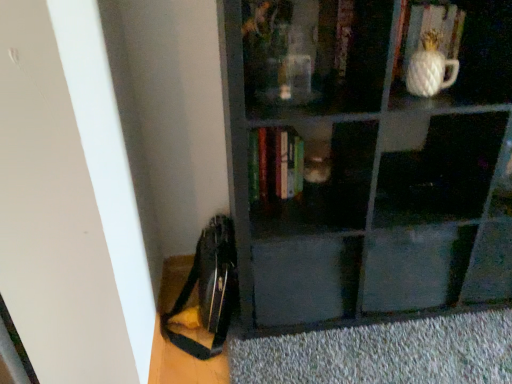
What is the approximate width of white textured vase at upper right?

It is 3.14 inches.

The height and width of the screenshot is (384, 512). Describe the element at coordinates (305, 280) in the screenshot. I see `matte black drawer at center` at that location.

In order to face wooden book at upper center, the second book positioned from the left, should I rotate leftwards or rightwards?

You should look right and rotate roughly 10.298 degrees.

Where is `gray textured doormat at lower right`? gray textured doormat at lower right is located at coordinates (383, 353).

Which is closer, (x=501, y=360) or (x=265, y=317)?

The point (x=501, y=360) is in front.

From a real-world perspective, is gray textured doormat at lower right on top of matte black drawer at center?

No, from a real-world perspective, gray textured doormat at lower right is not over matte black drawer at center

Would you say gray textured doormat at lower right is to the left or to the right of matte black drawer at center in the picture?

gray textured doormat at lower right is positioned on matte black drawer at center's right side.

Would you say gray textured doormat at lower right is outside matte black drawer at center?

gray textured doormat at lower right lies outside matte black drawer at center's area.

Considering the positions of objects white ceramic pineapple at upper right, positioned as the third book in left-to-right order, and gray textured doormat at lower right in the image provided, who is more to the left, white ceramic pineapple at upper right, positioned as the third book in left-to-right order, or gray textured doormat at lower right?

Positioned to the left is gray textured doormat at lower right.

Is white ceramic pineapple at upper right, marked as the 1th book in a right-to-left arrangement, in front of or behind gray textured doormat at lower right in the image?

Visually, white ceramic pineapple at upper right, marked as the 1th book in a right-to-left arrangement, is located behind gray textured doormat at lower right.

Considering the relative sizes of white ceramic pineapple at upper right, positioned as the third book in left-to-right order, and gray textured doormat at lower right in the image provided, is white ceramic pineapple at upper right, positioned as the third book in left-to-right order, taller than gray textured doormat at lower right?

Yes.

Does white ceramic pineapple at upper right, marked as the 1th book in a right-to-left arrangement, turn towards gray textured doormat at lower right?

No, white ceramic pineapple at upper right, marked as the 1th book in a right-to-left arrangement, is not aimed at gray textured doormat at lower right.

Is hardcover books at center, the 3th book when ordered from right to left, directly adjacent to white textured vase at upper right?

They are not placed beside each other.

From a real-world perspective, is hardcover books at center, the 3th book when ordered from right to left, located higher than white textured vase at upper right?

No, from a real-world perspective, hardcover books at center, the 3th book when ordered from right to left, is not over white textured vase at upper right

Which point is more distant from viewer, (291, 149) or (442, 36)?

Positioned behind is point (291, 149).

Is hardcover books at center, the 3th book when ordered from right to left, aimed at white textured vase at upper right?

No, hardcover books at center, the 3th book when ordered from right to left, does not turn towards white textured vase at upper right.

From a real-world perspective, is wooden book at upper center, which is the 2th book from right to left, located beneath gray textured doormat at lower right?

Actually, wooden book at upper center, which is the 2th book from right to left, is physically above gray textured doormat at lower right in the real world.

Is wooden book at upper center, which is the 2th book from right to left, positioned with its back to gray textured doormat at lower right?

No.

Is wooden book at upper center, the second book positioned from the left, surrounding gray textured doormat at lower right?

Actually, gray textured doormat at lower right is outside wooden book at upper center, the second book positioned from the left.

Which of these two, wooden book at upper center, which is the 2th book from right to left, or gray textured doormat at lower right, is wider?

gray textured doormat at lower right.

Looking at this image, is hardcover books at center, the first book viewed from the left, facing away from gray textured doormat at lower right?

No.

Is hardcover books at center, the first book viewed from the left, to the right of gray textured doormat at lower right from the viewer's perspective?

No.

Considering the sizes of objects hardcover books at center, the first book viewed from the left, and gray textured doormat at lower right in the image provided, who is bigger, hardcover books at center, the first book viewed from the left, or gray textured doormat at lower right?

gray textured doormat at lower right is bigger.

Is gray textured doormat at lower right to the right of white ceramic pineapple at upper right, marked as the 1th book in a right-to-left arrangement, from the viewer's perspective?

In fact, gray textured doormat at lower right is to the left of white ceramic pineapple at upper right, marked as the 1th book in a right-to-left arrangement.

Who is smaller, gray textured doormat at lower right or white ceramic pineapple at upper right, positioned as the third book in left-to-right order?

white ceramic pineapple at upper right, positioned as the third book in left-to-right order, is smaller.

How much distance is there between gray textured doormat at lower right and white ceramic pineapple at upper right, positioned as the third book in left-to-right order?

gray textured doormat at lower right is 34.56 inches from white ceramic pineapple at upper right, positioned as the third book in left-to-right order.

From the image's perspective, does gray textured doormat at lower right appear higher than white ceramic pineapple at upper right, marked as the 1th book in a right-to-left arrangement?

No.

Which is closer, (431, 95) or (288, 195)?

Point (431, 95)

How many degrees apart are the facing directions of white textured vase at upper right and hardcover books at center, the first book viewed from the left?

There is a 0.000396-degree angle between the facing directions of white textured vase at upper right and hardcover books at center, the first book viewed from the left.

From a real-world perspective, does white textured vase at upper right stand above hardcover books at center, the 3th book when ordered from right to left?

Correct, in the physical world, white textured vase at upper right is higher than hardcover books at center, the 3th book when ordered from right to left.

From the image's perspective, which is above, white textured vase at upper right or hardcover books at center, the first book viewed from the left?

white textured vase at upper right is shown above in the image.

Find the location of a particular element. drawer that is on the left side of gray textured doormat at lower right is located at coordinates (305, 280).

What are the coordinates of `book that is the 2nd one when counting backward from the gray textured doormat at lower right` in the screenshot? It's located at (431, 31).

In the scene shown: Based on their spatial positions, is matte black drawer at center or white textured vase at upper right closer to gray textured doormat at lower right?

matte black drawer at center is positioned closer to the anchor gray textured doormat at lower right.

From the image, which object appears to be nearer to white ceramic pineapple at upper right, marked as the 1th book in a right-to-left arrangement, gray textured doormat at lower right or matte black bookshelf at center?

Among the two, matte black bookshelf at center is located nearer to white ceramic pineapple at upper right, marked as the 1th book in a right-to-left arrangement.

Considering their positions, is hardcover books at center, the first book viewed from the left, positioned closer to white ceramic pineapple at upper right, marked as the 1th book in a right-to-left arrangement, than white textured vase at upper right?

Based on the image, white textured vase at upper right appears to be nearer to white ceramic pineapple at upper right, marked as the 1th book in a right-to-left arrangement.

Based on their spatial positions, is matte black bookshelf at center or white ceramic pineapple at upper right, marked as the 1th book in a right-to-left arrangement, closer to hardcover books at center, the first book viewed from the left?

matte black bookshelf at center is closer to hardcover books at center, the first book viewed from the left.

When comparing their distances from hardcover books at center, the first book viewed from the left, does gray textured doormat at lower right or wooden book at upper center, which is the 2th book from right to left, seem further?

gray textured doormat at lower right is positioned further to the anchor hardcover books at center, the first book viewed from the left.

Which object lies further to the anchor point gray textured doormat at lower right, hardcover books at center, the 3th book when ordered from right to left, or matte black drawer at center?

hardcover books at center, the 3th book when ordered from right to left, is positioned further to the anchor gray textured doormat at lower right.

Based on their spatial positions, is matte black bookshelf at center or gray textured doormat at lower right closer to white ceramic pineapple at upper right, positioned as the third book in left-to-right order?

Based on the image, matte black bookshelf at center appears to be nearer to white ceramic pineapple at upper right, positioned as the third book in left-to-right order.

From the image, which object appears to be farther from hardcover books at center, the first book viewed from the left, white textured vase at upper right or white ceramic pineapple at upper right, marked as the 1th book in a right-to-left arrangement?

white ceramic pineapple at upper right, marked as the 1th book in a right-to-left arrangement.

I want to click on book between white textured vase at upper right and gray textured doormat at lower right vertically, so click(275, 163).

Where is `drawer between matte black bookshelf at center and gray textured doormat at lower right in the up-down direction`? drawer between matte black bookshelf at center and gray textured doormat at lower right in the up-down direction is located at coordinates (305, 280).

This screenshot has width=512, height=384. I want to click on drawer between white ceramic pineapple at upper right, marked as the 1th book in a right-to-left arrangement, and gray textured doormat at lower right from top to bottom, so click(x=305, y=280).

Where is `drawer between hardcover books at center, the 3th book when ordered from right to left, and gray textured doormat at lower right vertically`? The width and height of the screenshot is (512, 384). drawer between hardcover books at center, the 3th book when ordered from right to left, and gray textured doormat at lower right vertically is located at coordinates (305, 280).